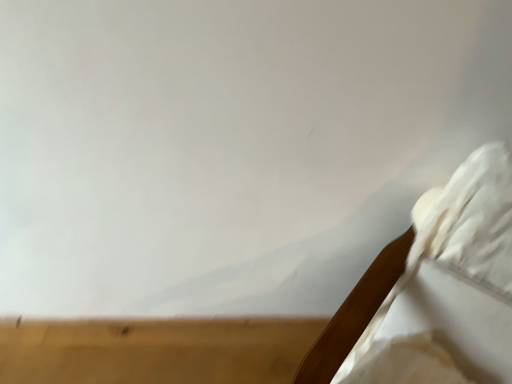
I want to click on white fabric bed at right, so click(434, 293).

The height and width of the screenshot is (384, 512). Describe the element at coordinates (434, 293) in the screenshot. I see `white fabric bed at right` at that location.

You are a GUI agent. You are given a task and a screenshot of the screen. Output one action in this format:
    pyautogui.click(x=<x>, y=<y>)
    Task: Click on the white fabric bed at right
    The height and width of the screenshot is (384, 512).
    Given the screenshot: What is the action you would take?
    pyautogui.click(x=434, y=293)